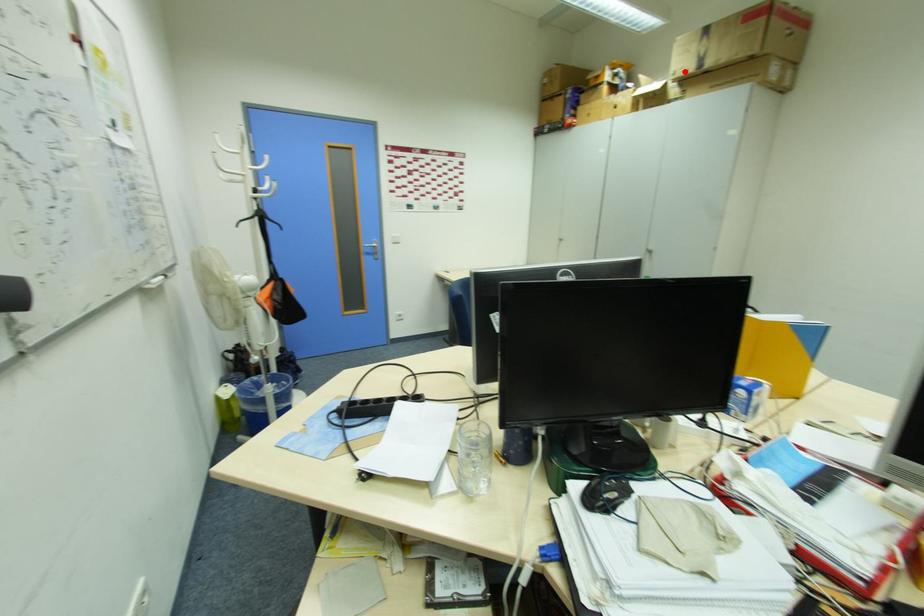
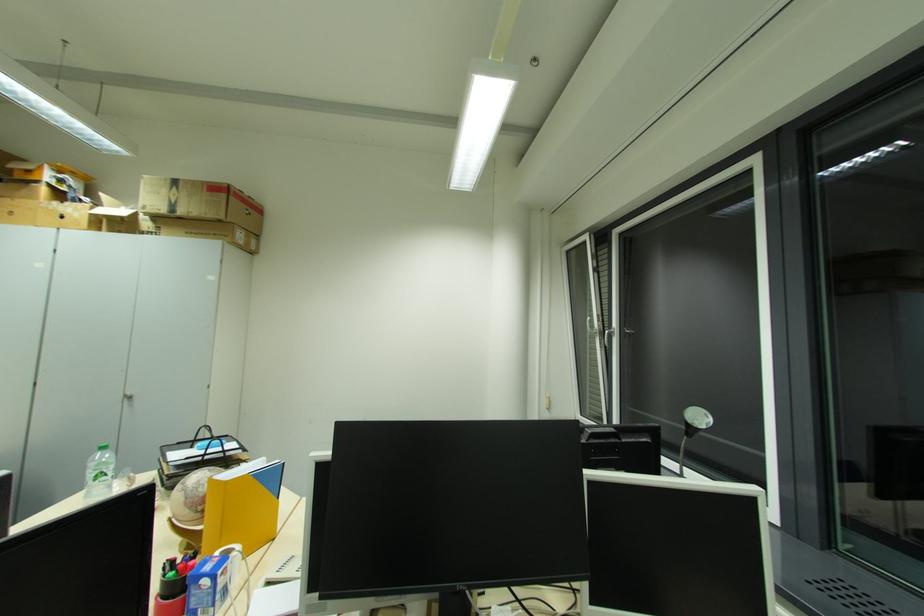
Locate, in the second image, the point that corresponds to the highlighted location in the first image.

(152, 209)